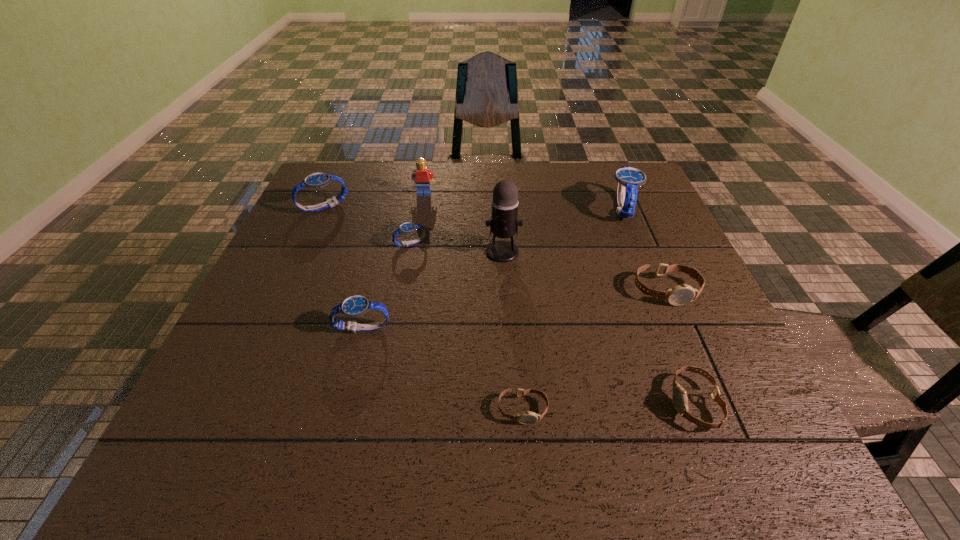
Find the location of a particular element. vacant area situated 0.180m on the back of the nearest blue watch is located at coordinates (379, 264).

Locate an element on the screen. The image size is (960, 540). vacant space situated 0.340m on the face of the biggest beige watch is located at coordinates (736, 454).

The height and width of the screenshot is (540, 960). What are the coordinates of `free space located on the back of the third farthest watch` in the screenshot? It's located at (417, 212).

Find the location of `vacant space located on the face of the second smallest beige watch`. vacant space located on the face of the second smallest beige watch is located at coordinates (520, 403).

Where is `vacant space located on the face of the second smallest beige watch`? The image size is (960, 540). vacant space located on the face of the second smallest beige watch is located at coordinates (483, 403).

What are the coordinates of `vacant space located on the face of the second smallest beige watch` in the screenshot? It's located at (456, 403).

Locate an element on the screen. The image size is (960, 540). blank space located 0.060m on the face of the shortest watch is located at coordinates (526, 458).

Where is `Lego present at the far edge`? The image size is (960, 540). Lego present at the far edge is located at coordinates (422, 175).

This screenshot has width=960, height=540. What are the coordinates of `object that is at the near edge` in the screenshot? It's located at (680, 401).

Where is `object present at the left edge`? This screenshot has height=540, width=960. object present at the left edge is located at coordinates (316, 180).